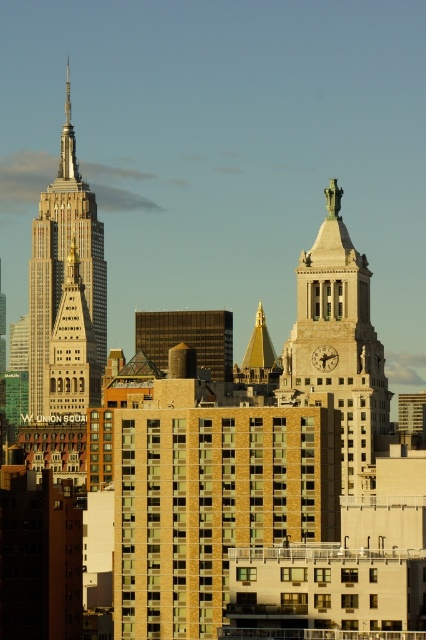
Question: Does golden stone clock tower at center have a lesser width compared to white marble skyscraper at center?

Choices:
 (A) yes
 (B) no

Answer: (B)

Question: Which of the following is the farthest from the observer?

Choices:
 (A) (367, 394)
 (B) (34, 272)

Answer: (B)

Question: Where is golden stone clock tower at center located in relation to white marble skyscraper at center in the image?

Choices:
 (A) left
 (B) right

Answer: (B)

Question: Which point is closer to the camera?

Choices:
 (A) (357, 401)
 (B) (95, 276)

Answer: (B)

Question: Is golden stone clock tower at center behind white marble skyscraper at center?

Choices:
 (A) yes
 (B) no

Answer: (B)